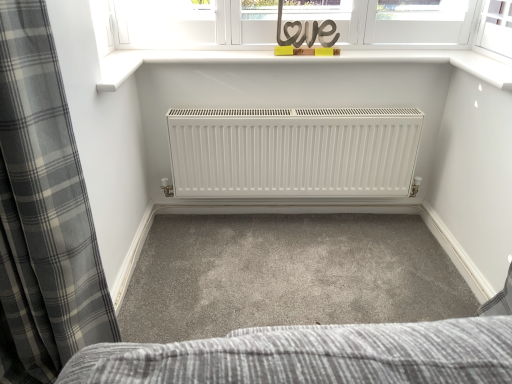
The image size is (512, 384). What do you see at coordinates (305, 32) in the screenshot? I see `wooden love sign at upper center` at bounding box center [305, 32].

Identify the location of wooden love sign at upper center. The width and height of the screenshot is (512, 384). (305, 32).

Measure the distance between gray plaid curtain at left and camera.

gray plaid curtain at left and camera are 81.45 centimeters apart.

At what (x,y) coordinates should I click in order to perform the action: click on gray plaid curtain at left. Please return your answer as a coordinate pair (x, y). Image resolution: width=512 pixels, height=384 pixels. Looking at the image, I should click on (42, 212).

Describe the element at coordinates (42, 212) in the screenshot. Image resolution: width=512 pixels, height=384 pixels. I see `gray plaid curtain at left` at that location.

This screenshot has width=512, height=384. Find the location of `wooden love sign at upper center`. wooden love sign at upper center is located at coordinates (305, 32).

Looking at this image, visually, is gray plaid curtain at left positioned to the left or to the right of wooden love sign at upper center?

From the image, it's evident that gray plaid curtain at left is to the left of wooden love sign at upper center.

Is gray plaid curtain at left positioned in front of wooden love sign at upper center?

Yes, gray plaid curtain at left is in front of wooden love sign at upper center.

Is point (14, 368) closer or farther from the camera than point (329, 36)?

Point (14, 368).

From the image's perspective, does gray plaid curtain at left appear lower than wooden love sign at upper center?

Correct, gray plaid curtain at left appears lower than wooden love sign at upper center in the image.

From a real-world perspective, who is located higher, gray plaid curtain at left or wooden love sign at upper center?

From a 3D spatial view, wooden love sign at upper center is above.

Which of these two, gray plaid curtain at left or wooden love sign at upper center, is thinner?

Thinner between the two is wooden love sign at upper center.

Does gray plaid curtain at left have a lesser height compared to wooden love sign at upper center?

Incorrect, the height of gray plaid curtain at left does not fall short of that of wooden love sign at upper center.

Does gray plaid curtain at left have a smaller size compared to wooden love sign at upper center?

No, gray plaid curtain at left is not smaller than wooden love sign at upper center.

Is gray plaid curtain at left outside of wooden love sign at upper center?

Indeed, gray plaid curtain at left is completely outside wooden love sign at upper center.

Is gray plaid curtain at left with wooden love sign at upper center?

No, gray plaid curtain at left is not beside wooden love sign at upper center.

Is gray plaid curtain at left positioned with its back to wooden love sign at upper center?

No, wooden love sign at upper center is not at the back of gray plaid curtain at left.

How many degrees apart are the facing directions of gray plaid curtain at left and wooden love sign at upper center?

5.14 degrees.

You are a GUI agent. You are given a task and a screenshot of the screen. Output one action in this format:
    pyautogui.click(x=<x>, y=<y>)
    Task: Click on the writing above the gray plaid curtain at left (from the image's perspective)
    
    Given the screenshot: What is the action you would take?
    [305, 32]

Between wooden love sign at upper center and gray plaid curtain at left, which one appears on the left side from the viewer's perspective?

gray plaid curtain at left is more to the left.

Which is in front, wooden love sign at upper center or gray plaid curtain at left?

gray plaid curtain at left is more forward.

Between point (287, 27) and point (93, 232), which one is positioned behind?

The point (287, 27) is farther from the camera.

Consider the image. From the image's perspective, is wooden love sign at upper center below gray plaid curtain at left?

No.

From a real-world perspective, who is located lower, wooden love sign at upper center or gray plaid curtain at left?

gray plaid curtain at left, from a real-world perspective.

Which of these two, wooden love sign at upper center or gray plaid curtain at left, is thinner?

wooden love sign at upper center.

Is wooden love sign at upper center taller or shorter than gray plaid curtain at left?

In the image, wooden love sign at upper center appears to be shorter than gray plaid curtain at left.

Considering the relative sizes of wooden love sign at upper center and gray plaid curtain at left in the image provided, is wooden love sign at upper center smaller than gray plaid curtain at left?

Correct, wooden love sign at upper center occupies less space than gray plaid curtain at left.

Is wooden love sign at upper center spatially inside gray plaid curtain at left, or outside of it?

wooden love sign at upper center is located beyond the bounds of gray plaid curtain at left.

Are wooden love sign at upper center and gray plaid curtain at left located far from each other?

wooden love sign at upper center is positioned a significant distance from gray plaid curtain at left.

Consider the image. Could you tell me if wooden love sign at upper center is turned towards gray plaid curtain at left?

No, wooden love sign at upper center is not turned towards gray plaid curtain at left.

Where is `curtain that is on the left side of wooden love sign at upper center`? Image resolution: width=512 pixels, height=384 pixels. curtain that is on the left side of wooden love sign at upper center is located at coordinates (42, 212).

At what (x,y) coordinates should I click in order to perform the action: click on curtain in front of the wooden love sign at upper center. Please return your answer as a coordinate pair (x, y). Looking at the image, I should click on [42, 212].

Where is `writing behind the gray plaid curtain at left`? The image size is (512, 384). writing behind the gray plaid curtain at left is located at coordinates (305, 32).